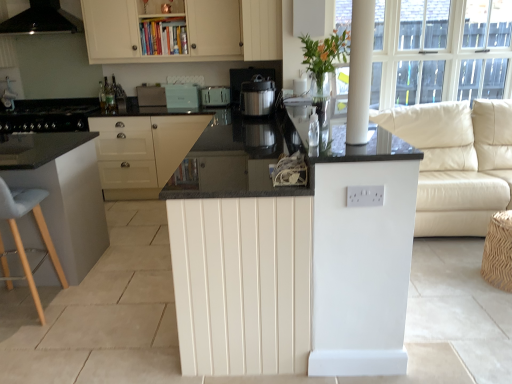
Question: From their relative heights in the image, would you say brown woven stool at lower right, positioned as the 2th bar stool in left-to-right order, is taller or shorter than white glossy pillar at upper right?

Choices:
 (A) tall
 (B) short

Answer: (B)

Question: Based on their positions, is brown woven stool at lower right, positioned as the 2th bar stool in left-to-right order, located to the left or right of white glossy pillar at upper right?

Choices:
 (A) left
 (B) right

Answer: (B)

Question: Estimate the real-world distances between objects in this image. Which object is farther from the metallic silver coffee maker at center?

Choices:
 (A) white leather couch at right
 (B) translucent glass vase at upper center
 (C) white plastic toaster at upper center, the third appliance positioned from the right
 (D) black matte range hood at upper left
 (E) white glossy counter at center

Answer: (D)

Question: Which is farther from the matte cream cabinet at upper center, arranged as the 3th cabinetry when ordered from the bottom?

Choices:
 (A) white plastic toaster at upper center, which ranks as the second appliance in left-to-right order
 (B) satin silver toaster at center, acting as the 4th appliance starting from the left
 (C) teal matte toaster at upper center, which ranks as the 3th appliance in left-to-right order
 (D) white glossy pillar at upper right
 (E) translucent glass vase at upper center

Answer: (D)